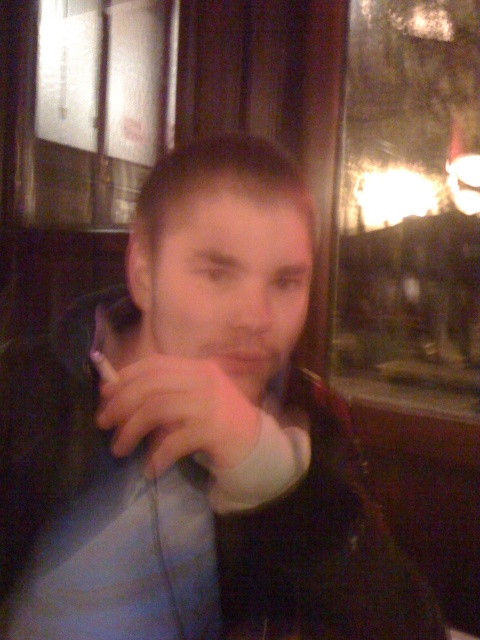
Question: Which point is closer to the camera taking this photo?

Choices:
 (A) (139, 429)
 (B) (180, 161)

Answer: (A)

Question: In this image, where is matte black phone at center located relative to white matte hand at center?

Choices:
 (A) right
 (B) left

Answer: (A)

Question: Is matte black phone at center smaller than white matte hand at center?

Choices:
 (A) no
 (B) yes

Answer: (A)

Question: Which object appears farthest from the camera in this image?

Choices:
 (A) white matte hand at center
 (B) matte black phone at center

Answer: (A)

Question: Is matte black phone at center bigger than white matte hand at center?

Choices:
 (A) yes
 (B) no

Answer: (A)